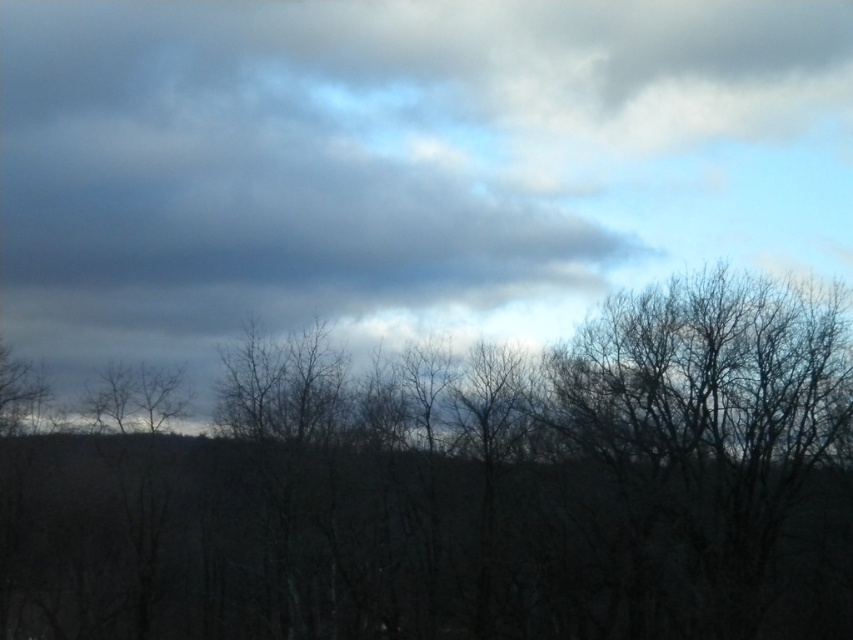
In the image, there is a point labeled as point [399,164]. Based on the scene description, what does this point most likely represent?

The point [399,164] most likely represents the cloudy sky at upper center as described in the scene.

You are an astronomer analyzing the image. You need to locate the cloudy sky at upper center. What are its coordinates?

The cloudy sky at upper center is located at coordinates [399,164].